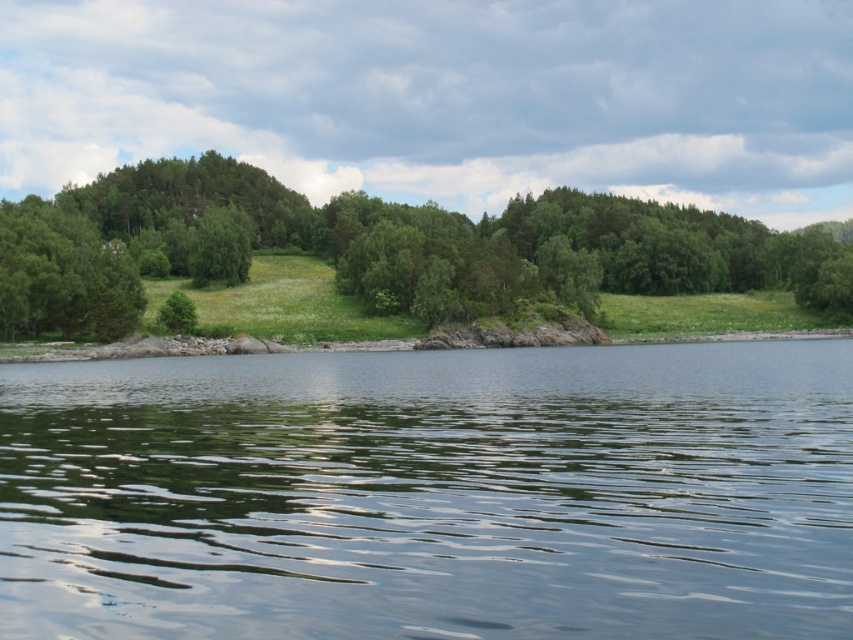
You are standing at the origin point of the coordinate system in the scene. You want to place a small boat exactly where the green reflective water at center is located. What are the coordinates where you should place the boat?

The coordinates for the green reflective water at center are at point (x=431, y=493). You should place the boat at those coordinates.

You are standing on the grassy area near the shoreline in the image. You see the green reflective water at center and the green leafy trees at center. Which object is taller from your perspective?

The green leafy trees at center are taller than the green reflective water at center.

You are standing on the grassy shoreline and want to take a photo of the green leafy trees at center and the green reflective water at center. Which object should you point your camera towards first if you want to capture both in a single shot?

You should point your camera towards the green leafy trees at center first because they are above the green reflective water at center, allowing both to be captured in the same frame.